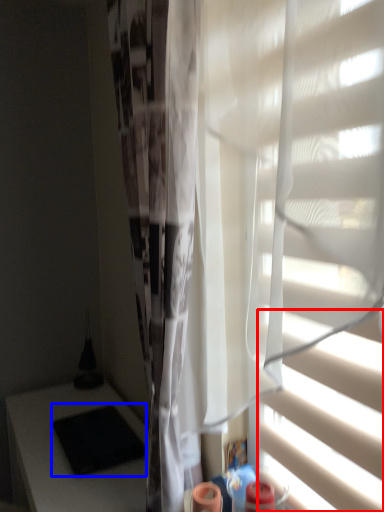
Question: Among these objects, which one is farthest to the camera, blind (highlighted by a red box) or pad (highlighted by a blue box)?

Choices:
 (A) blind
 (B) pad

Answer: (B)